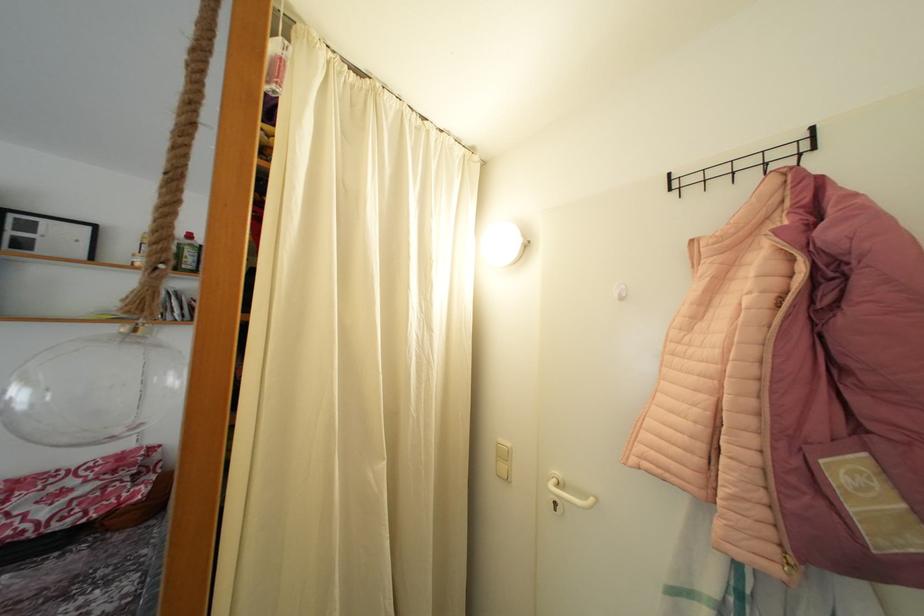
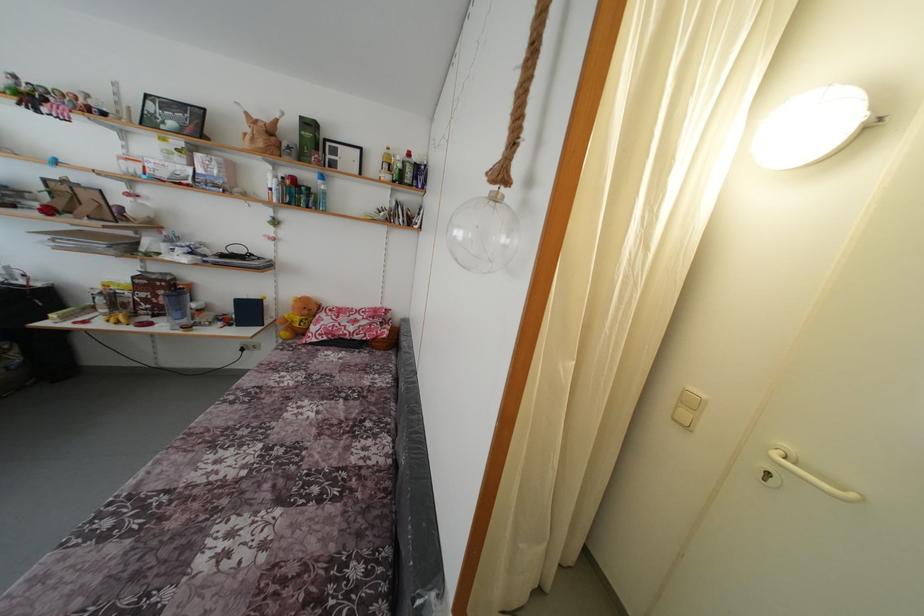
In the second image, find the point that corresponds to pixel 598 505 in the first image.

(859, 501)